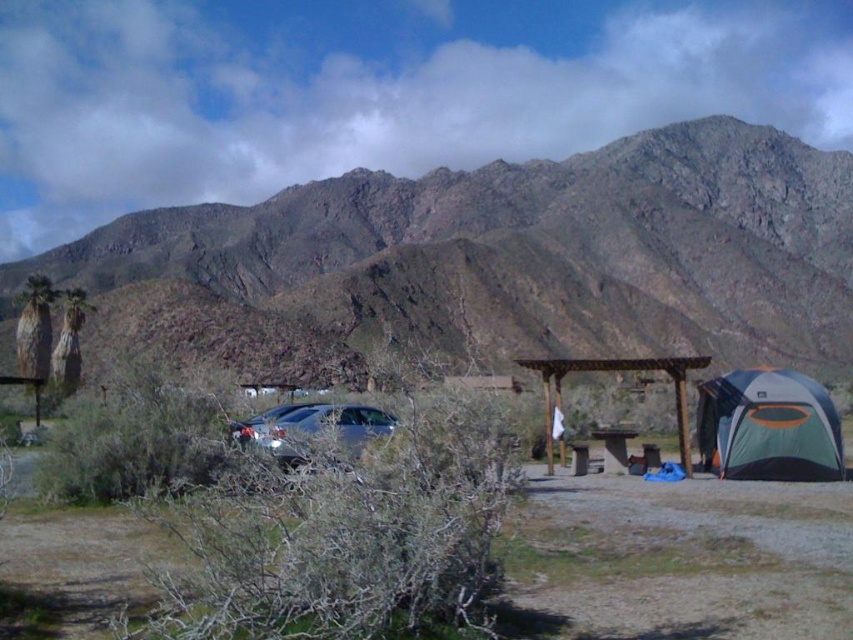
Question: Which object is closer to the camera taking this photo?

Choices:
 (A) green and gray fabric tent at lower right
 (B) rugged rock mountain range at upper center
 (C) brown wooden gazebo at center
 (D) satin silver car at center

Answer: (D)

Question: Is rugged rock mountain range at upper center thinner than brown wooden gazebo at center?

Choices:
 (A) yes
 (B) no

Answer: (B)

Question: Which of the following is the farthest from the observer?

Choices:
 (A) brown wooden gazebo at center
 (B) rugged rock mountain range at upper center
 (C) wooden picnic table at center

Answer: (B)

Question: Is green and gray fabric tent at lower right bigger than satin silver car at center?

Choices:
 (A) no
 (B) yes

Answer: (A)

Question: Among these objects, which one is nearest to the camera?

Choices:
 (A) brown wooden gazebo at center
 (B) satin silver car at center
 (C) rugged rock mountain range at upper center

Answer: (B)

Question: Can you confirm if satin silver car at center is bigger than brown wooden gazebo at center?

Choices:
 (A) yes
 (B) no

Answer: (B)